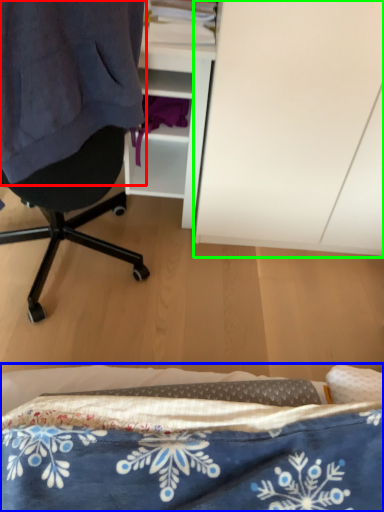
Question: Estimate the real-world distances between objects in this image. Which object is farther from clothing (highlighted by a red box), bed (highlighted by a blue box) or cabinetry (highlighted by a green box)?

Choices:
 (A) bed
 (B) cabinetry

Answer: (A)